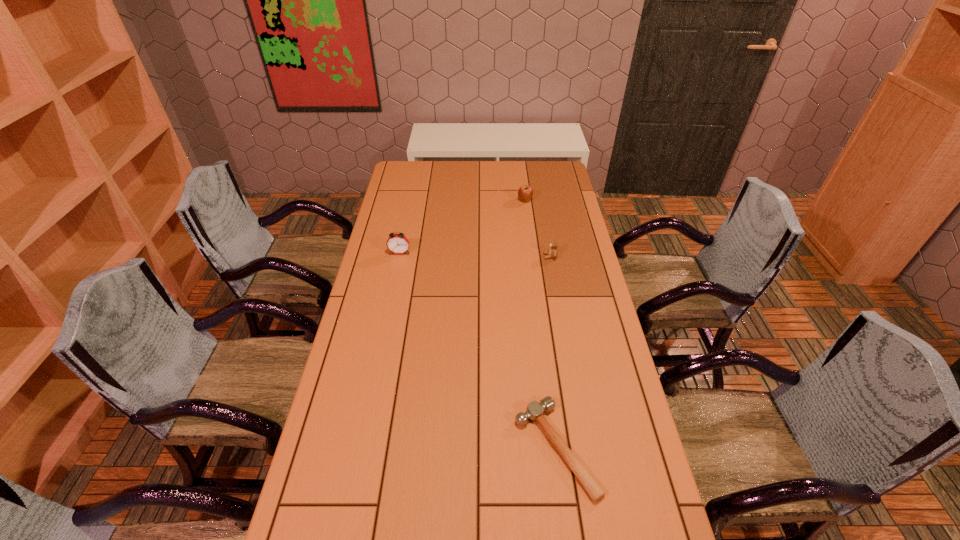
Locate an element on the screen. blank space located 0.350m on the front-facing side of the teddy bear is located at coordinates (455, 256).

The height and width of the screenshot is (540, 960). I want to click on vacant space positioned on the left of the shortest object, so click(x=487, y=448).

Where is `object situated at the left edge`? Image resolution: width=960 pixels, height=540 pixels. object situated at the left edge is located at coordinates (397, 243).

Identify the location of teddy bear present at the right edge. Image resolution: width=960 pixels, height=540 pixels. (553, 252).

The image size is (960, 540). In order to click on hammer present at the right edge in this screenshot , I will do `click(535, 410)`.

Locate an element on the screen. This screenshot has height=540, width=960. vacant space at the far edge is located at coordinates coord(503,167).

I want to click on free region at the left edge, so click(367, 442).

Where is `free space at the right edge of the desktop`? Image resolution: width=960 pixels, height=540 pixels. free space at the right edge of the desktop is located at coordinates [558, 284].

Locate an element on the screen. This screenshot has width=960, height=540. free space at the far left corner of the desktop is located at coordinates (421, 173).

The width and height of the screenshot is (960, 540). I want to click on free spot at the far right corner of the desktop, so click(x=540, y=160).